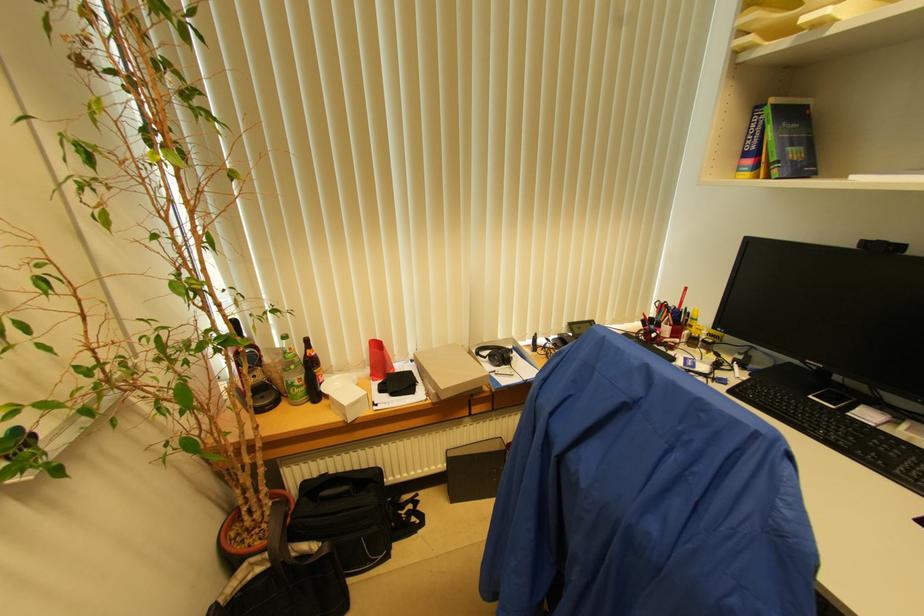
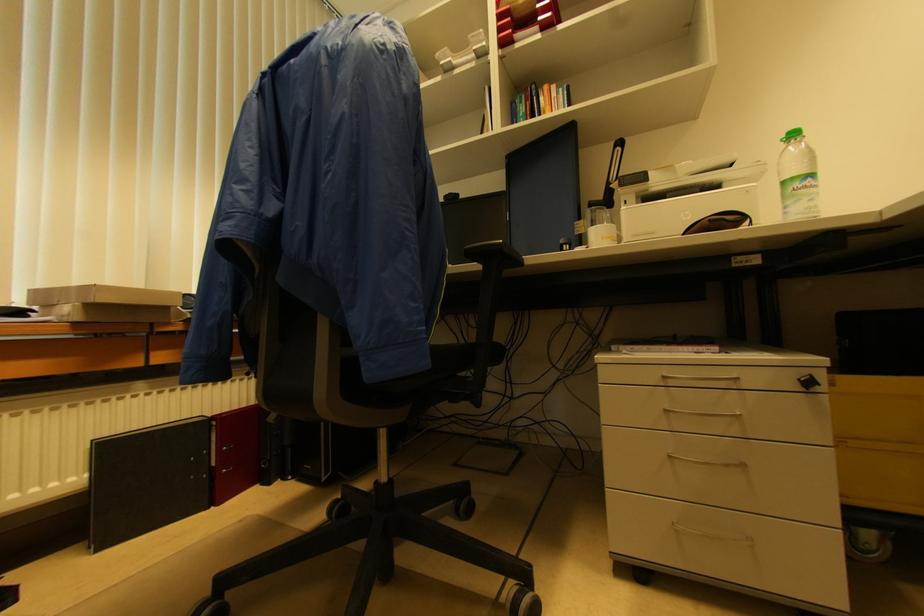
How did the camera likely rotate?

The camera's rotation is toward right-up.